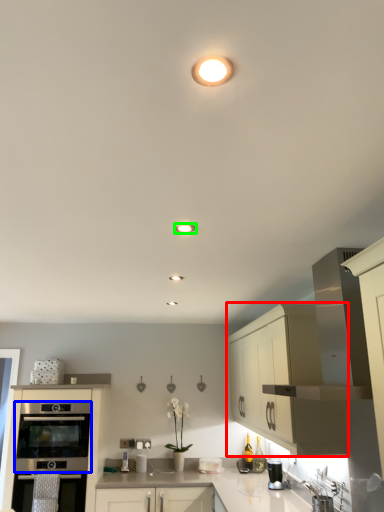
Question: Which object is positioned farthest from cabinetry (highlighted by a red box)? Select from oven (highlighted by a blue box) and lighting (highlighted by a green box).

Choices:
 (A) oven
 (B) lighting

Answer: (A)